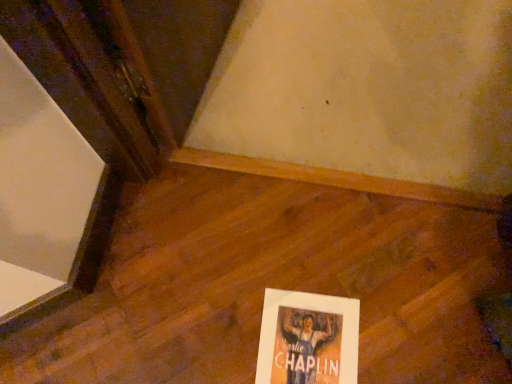
You are a GUI agent. You are given a task and a screenshot of the screen. Output one action in this format:
    pyautogui.click(x=<x>, y=<y>)
    Task: Click on the empty space that is ontop of matte paper poster at lower right (from a real-world perspective)
    This screenshot has height=384, width=512.
    Given the screenshot: What is the action you would take?
    pyautogui.click(x=307, y=344)